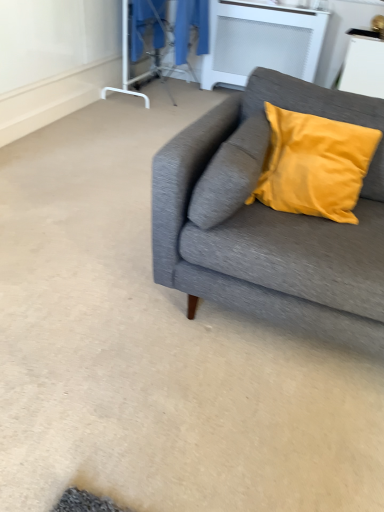
Question: Considering the relative sizes of white matte radiator at upper center, the 1th table from the back, and white glossy table at upper right, arranged as the first table when viewed from the right, in the image provided, is white matte radiator at upper center, the 1th table from the back, bigger than white glossy table at upper right, arranged as the first table when viewed from the right,?

Choices:
 (A) yes
 (B) no

Answer: (A)

Question: Is white matte radiator at upper center, which appears as the second table when viewed from the right, closer to the viewer compared to white glossy table at upper right, which appears as the 2th table when viewed from the back?

Choices:
 (A) yes
 (B) no

Answer: (B)

Question: From a real-world perspective, is white matte radiator at upper center, which appears as the second table when viewed from the right, over white glossy table at upper right, arranged as the first table when viewed from the right?

Choices:
 (A) yes
 (B) no

Answer: (B)

Question: Considering the relative positions of white matte radiator at upper center, which is counted as the 1th table, starting from the left, and white glossy table at upper right, positioned as the second table in left-to-right order, in the image provided, is white matte radiator at upper center, which is counted as the 1th table, starting from the left, behind white glossy table at upper right, positioned as the second table in left-to-right order,?

Choices:
 (A) no
 (B) yes

Answer: (B)

Question: Is white matte radiator at upper center, which appears as the second table when viewed from the right, outside white glossy table at upper right, arranged as the 1th table when viewed from the front?

Choices:
 (A) no
 (B) yes

Answer: (B)

Question: Considering the positions of white glossy table at upper right, which appears as the 2th table when viewed from the back, and transparent plastic screen door at upper center in the image, is white glossy table at upper right, which appears as the 2th table when viewed from the back, wider or thinner than transparent plastic screen door at upper center?

Choices:
 (A) thin
 (B) wide

Answer: (B)

Question: In the image, is white glossy table at upper right, positioned as the second table in left-to-right order, positioned in front of or behind transparent plastic screen door at upper center?

Choices:
 (A) behind
 (B) front

Answer: (B)

Question: Which is correct: white glossy table at upper right, arranged as the first table when viewed from the right, is inside transparent plastic screen door at upper center, or outside of it?

Choices:
 (A) inside
 (B) outside

Answer: (B)

Question: From the image's perspective, is white glossy table at upper right, positioned as the second table in left-to-right order, located above or below transparent plastic screen door at upper center?

Choices:
 (A) above
 (B) below

Answer: (B)

Question: Is point (137, 17) positioned closer to the camera than point (124, 70)?

Choices:
 (A) closer
 (B) farther

Answer: (B)

Question: Looking at their shapes, would you say blue fabric laundry at upper center is wider or thinner than transparent plastic screen door at upper center?

Choices:
 (A) wide
 (B) thin

Answer: (A)

Question: From a real-world perspective, is blue fabric laundry at upper center positioned above or below transparent plastic screen door at upper center?

Choices:
 (A) above
 (B) below

Answer: (B)

Question: Is blue fabric laundry at upper center to the left or to the right of transparent plastic screen door at upper center in the image?

Choices:
 (A) left
 (B) right

Answer: (B)

Question: Is white glossy table at upper right, arranged as the 1th table when viewed from the front, inside the boundaries of textured gray couch at right, or outside?

Choices:
 (A) outside
 (B) inside

Answer: (A)

Question: Considering the positions of white glossy table at upper right, which appears as the 2th table when viewed from the back, and textured gray couch at right in the image, is white glossy table at upper right, which appears as the 2th table when viewed from the back, taller or shorter than textured gray couch at right?

Choices:
 (A) tall
 (B) short

Answer: (B)